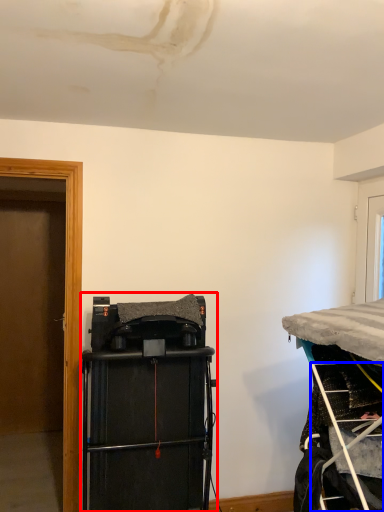
Question: Which of the following is the closest to the observer, equipment (highlighted by a red box) or ladder (highlighted by a blue box)?

Choices:
 (A) equipment
 (B) ladder

Answer: (B)